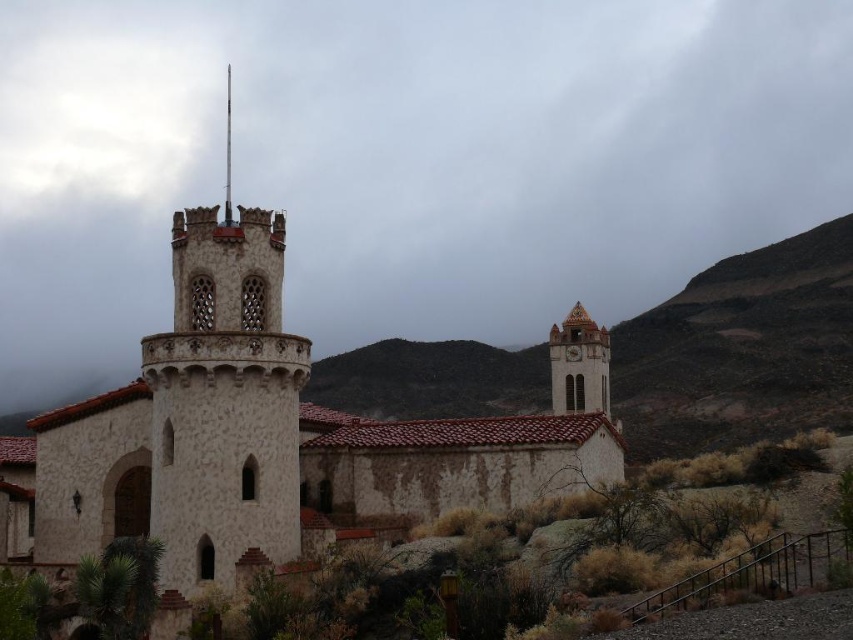
Is point (227, 116) positioned in front of point (570, 348)?

No, it is not.

The height and width of the screenshot is (640, 853). What do you see at coordinates (228, 152) in the screenshot?
I see `smooth stone spire at upper center` at bounding box center [228, 152].

What are the coordinates of `smooth stone spire at upper center` in the screenshot? It's located at (228, 152).

Is white stone church at center bigger than white stone clock at upper right?

Correct, white stone church at center is larger in size than white stone clock at upper right.

Who is taller, white stone church at center or white stone clock at upper right?

With more height is white stone church at center.

Between point (85, 412) and point (577, 349), which one is positioned behind?

Point (577, 349)

This screenshot has height=640, width=853. I want to click on white stone church at center, so click(x=257, y=440).

Is white stone church at center to the left of matte beige clock tower at center-right from the viewer's perspective?

Correct, you'll find white stone church at center to the left of matte beige clock tower at center-right.

Can you confirm if white stone church at center is positioned to the right of matte beige clock tower at center-right?

No, white stone church at center is not to the right of matte beige clock tower at center-right.

Find the location of a particular element. The width and height of the screenshot is (853, 640). white stone church at center is located at coordinates (257, 440).